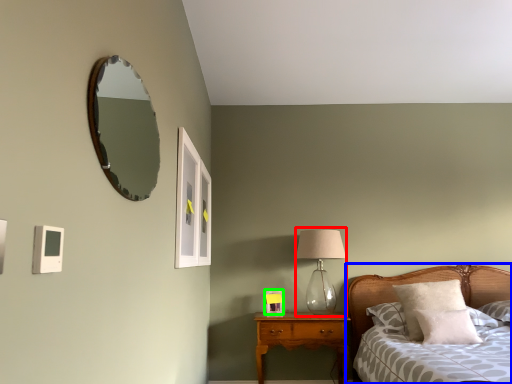
Question: Which is farther away from table lamp (highlighted by a red box)? bed (highlighted by a blue box) or picture frame (highlighted by a green box)?

Choices:
 (A) bed
 (B) picture frame

Answer: (A)